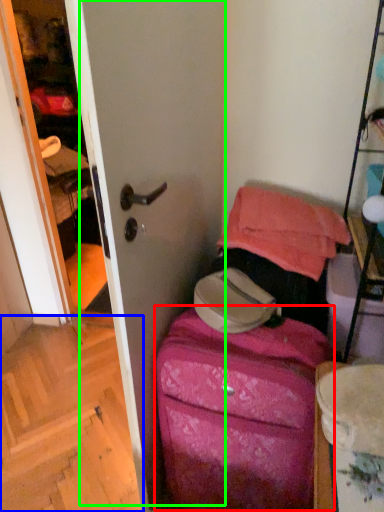
Question: Which object is positioned farthest from luggage (highlighted by a red box)? Select from stairwell (highlighted by a blue box) and screen door (highlighted by a green box).

Choices:
 (A) stairwell
 (B) screen door

Answer: (A)